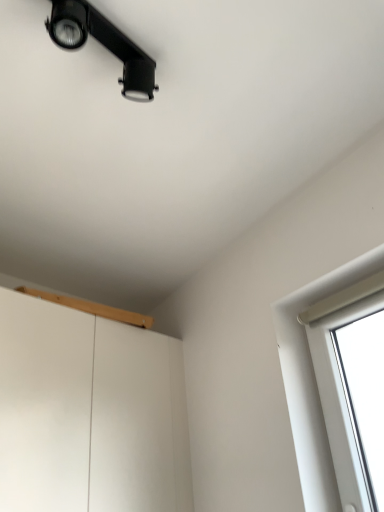
Question: Is black matte track light at upper left situated inside light wood/wooden window sill at upper center or outside?

Choices:
 (A) inside
 (B) outside

Answer: (B)

Question: Is black matte track light at upper left taller or shorter than light wood/wooden window sill at upper center?

Choices:
 (A) tall
 (B) short

Answer: (A)

Question: From a real-world perspective, is black matte track light at upper left above or below light wood/wooden window sill at upper center?

Choices:
 (A) above
 (B) below

Answer: (A)

Question: Is light wood/wooden window sill at upper center to the left or to the right of black matte track light at upper left in the image?

Choices:
 (A) left
 (B) right

Answer: (A)

Question: Based on their sizes in the image, would you say light wood/wooden window sill at upper center is bigger or smaller than black matte track light at upper left?

Choices:
 (A) big
 (B) small

Answer: (A)

Question: From the image's perspective, is light wood/wooden window sill at upper center above or below black matte track light at upper left?

Choices:
 (A) below
 (B) above

Answer: (A)

Question: Is light wood/wooden window sill at upper center inside or outside of black matte track light at upper left?

Choices:
 (A) inside
 (B) outside

Answer: (B)